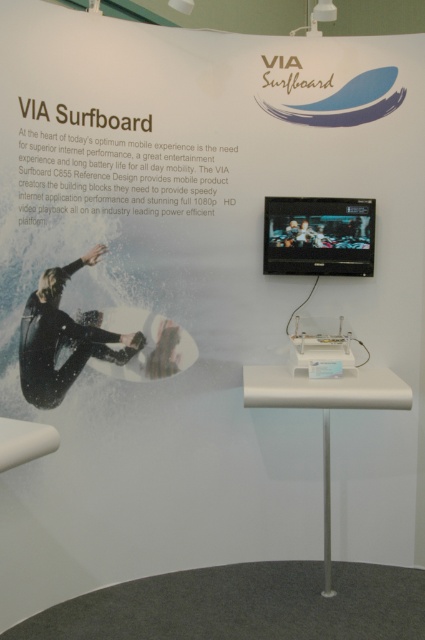
Question: Can you confirm if black matte surfboard at center is positioned below white matte surfboard at center?

Choices:
 (A) yes
 (B) no

Answer: (B)

Question: Which of the following is the farthest from the observer?

Choices:
 (A) [146, 352]
 (B) [74, 332]

Answer: (A)

Question: Observing the image, what is the correct spatial positioning of black matte surfboard at center in reference to white matte surfboard at center?

Choices:
 (A) below
 (B) above

Answer: (B)

Question: Does black matte surfboard at center appear on the left side of white matte surfboard at center?

Choices:
 (A) yes
 (B) no

Answer: (A)